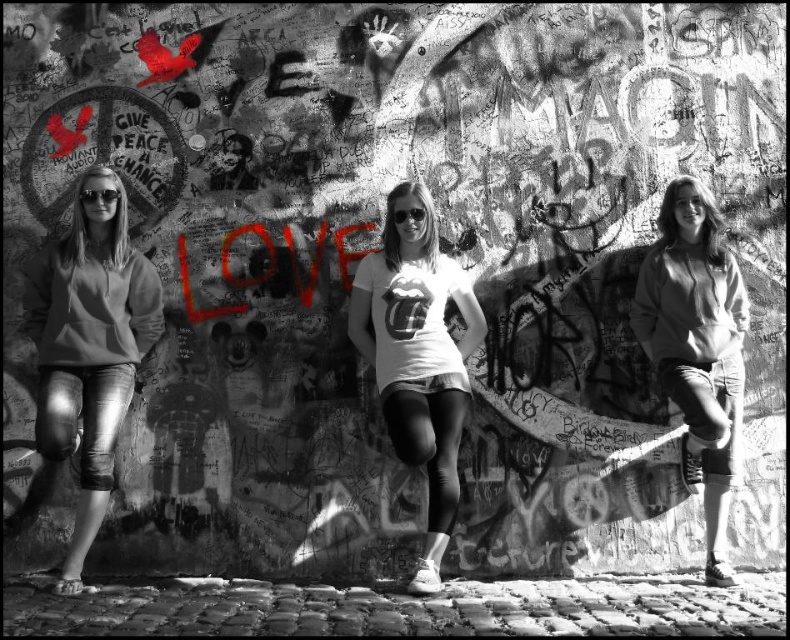
Who is positioned more to the left, denim jeans at left or denim shorts at center?

denim jeans at left

Describe the element at coordinates (89, 346) in the screenshot. I see `denim jeans at left` at that location.

Who is more distant from viewer, (100, 413) or (732, 369)?

Positioned behind is point (732, 369).

Identify the location of denim jeans at left. (89, 346).

Describe the element at coordinates (89, 346) in the screenshot. I see `denim jeans at left` at that location.

Between point (119, 260) and point (438, 493), which one is positioned in front?

Point (438, 493) is more forward.

I want to click on denim jeans at left, so point(89,346).

Consider the image. Does white matte t-shirt at center have a lesser width compared to denim shorts at center?

No, white matte t-shirt at center is not thinner than denim shorts at center.

Does white matte t-shirt at center have a larger size compared to denim shorts at center?

Yes, white matte t-shirt at center is bigger than denim shorts at center.

This screenshot has width=790, height=640. I want to click on white matte t-shirt at center, so click(x=416, y=355).

You are a GUI agent. You are given a task and a screenshot of the screen. Output one action in this format:
    pyautogui.click(x=<x>, y=<y>)
    Task: Click on the white matte t-shirt at center
    Image resolution: width=790 pixels, height=640 pixels.
    Given the screenshot: What is the action you would take?
    pyautogui.click(x=416, y=355)